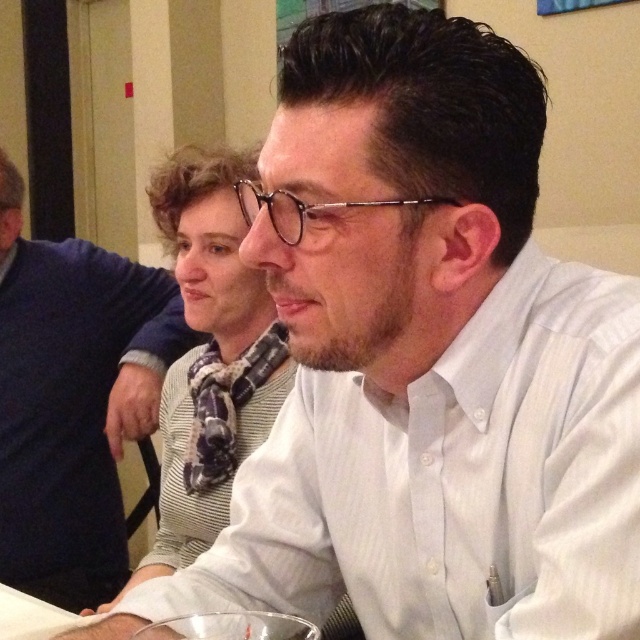
Question: Among these objects, which one is nearest to the camera?

Choices:
 (A) white shirt at upper center
 (B) clear glass wine glass at center

Answer: (B)

Question: Does white shirt at upper center appear on the left side of clear glass wine glass at center?

Choices:
 (A) no
 (B) yes

Answer: (B)

Question: Which of the following is the farthest from the observer?

Choices:
 (A) (234, 621)
 (B) (22, 544)

Answer: (B)

Question: Is white shirt at upper center positioned behind clear glass wine glass at center?

Choices:
 (A) no
 (B) yes

Answer: (B)

Question: Is white shirt at upper center further to camera compared to clear glass wine glass at center?

Choices:
 (A) no
 (B) yes

Answer: (B)